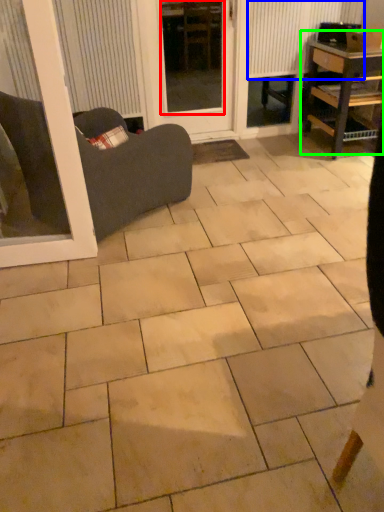
Question: Considering the real-world distances, which object is closest to window screen (highlighted by a red box)? radiator (highlighted by a blue box) or table (highlighted by a green box).

Choices:
 (A) radiator
 (B) table

Answer: (A)